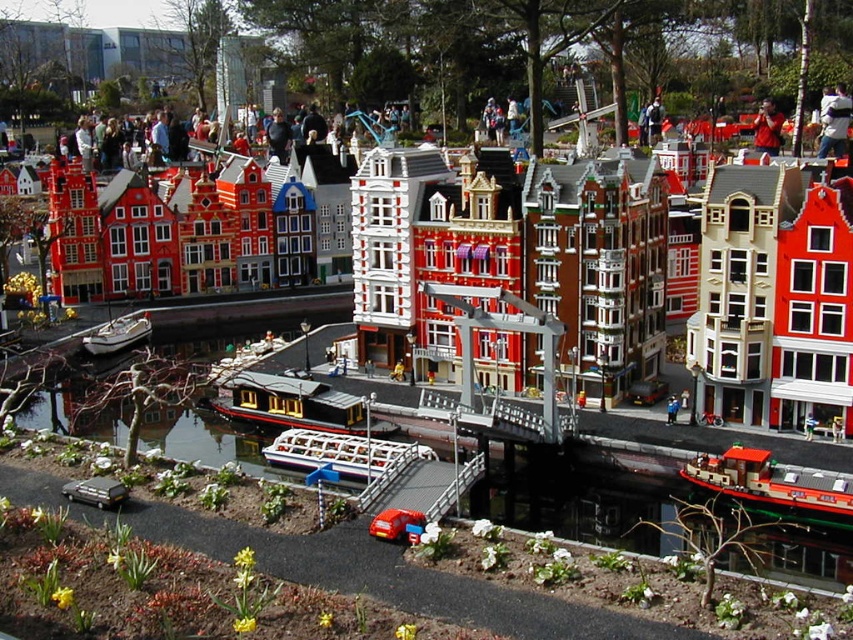
Is the position of red plastic boat at lower right less distant than that of reddish-brown leather jacket at upper right?

Yes, red plastic boat at lower right is closer to the viewer.

Can you confirm if red plastic boat at lower right is taller than reddish-brown leather jacket at upper right?

No, red plastic boat at lower right is not taller than reddish-brown leather jacket at upper right.

Where is `red plastic boat at lower right`? The image size is (853, 640). red plastic boat at lower right is located at coordinates (773, 486).

Is point (126, 339) positioned behind point (674, 420)?

Yes, point (126, 339) is farther from viewer.

Which is more to the left, white plastic boat at center-left or blue fabric person at center?

white plastic boat at center-left is more to the left.

Is point (111, 326) less distant than point (669, 410)?

No, (111, 326) is further to viewer.

At what (x,y) coordinates should I click in order to perform the action: click on white plastic boat at center-left. Please return your answer as a coordinate pair (x, y). This screenshot has height=640, width=853. Looking at the image, I should click on (117, 333).

Does clear plastic water at center lie behind white fabric jacket at upper center?

No, it is in front of white fabric jacket at upper center.

Does clear plastic water at center appear on the right side of white fabric jacket at upper center?

Incorrect, clear plastic water at center is not on the right side of white fabric jacket at upper center.

Between point (428, 481) and point (824, 129), which one is positioned in front?

Positioned in front is point (428, 481).

Image resolution: width=853 pixels, height=640 pixels. What are the coordinates of `clear plastic water at center` in the screenshot? It's located at coord(631,460).